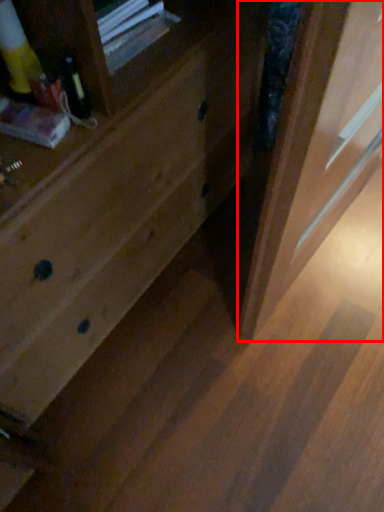
Question: From the image's perspective, where is screen door (annotated by the red box) located in relation to drawer in the image?

Choices:
 (A) below
 (B) above

Answer: (A)